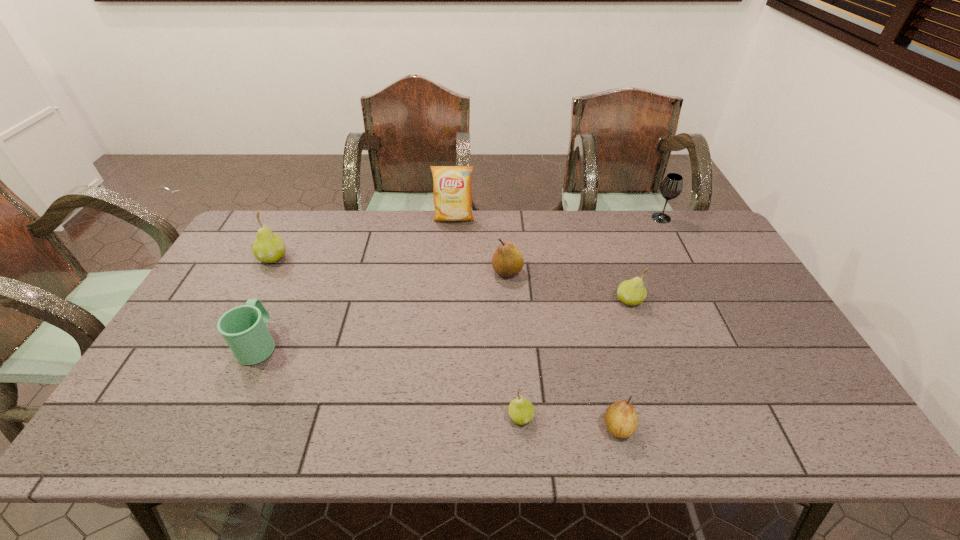
Identify the location of mug. The height and width of the screenshot is (540, 960). (244, 328).

Locate an element on the screen. Image resolution: width=960 pixels, height=540 pixels. the third nearest object is located at coordinates (244, 328).

What are the coordinates of `the second green pear from left to right` in the screenshot? It's located at (521, 411).

What are the coordinates of `the smallest green pear` in the screenshot? It's located at (521, 411).

What are the coordinates of `the nearer brown pear` in the screenshot? It's located at (621, 418).

The image size is (960, 540). I want to click on the smaller brown pear, so click(x=621, y=418).

Where is `vacant space located 0.220m on the front-facing side of the crisp (potato chip)`? The image size is (960, 540). vacant space located 0.220m on the front-facing side of the crisp (potato chip) is located at coordinates (450, 267).

Find the location of `free space located on the right of the rightmost object`. free space located on the right of the rightmost object is located at coordinates (709, 218).

Where is `free spot located 0.240m on the front of the biggest green pear`? free spot located 0.240m on the front of the biggest green pear is located at coordinates (237, 326).

Find the location of a particular element. This screenshot has height=540, width=960. free space located 0.140m on the front of the bigger brown pear is located at coordinates (511, 316).